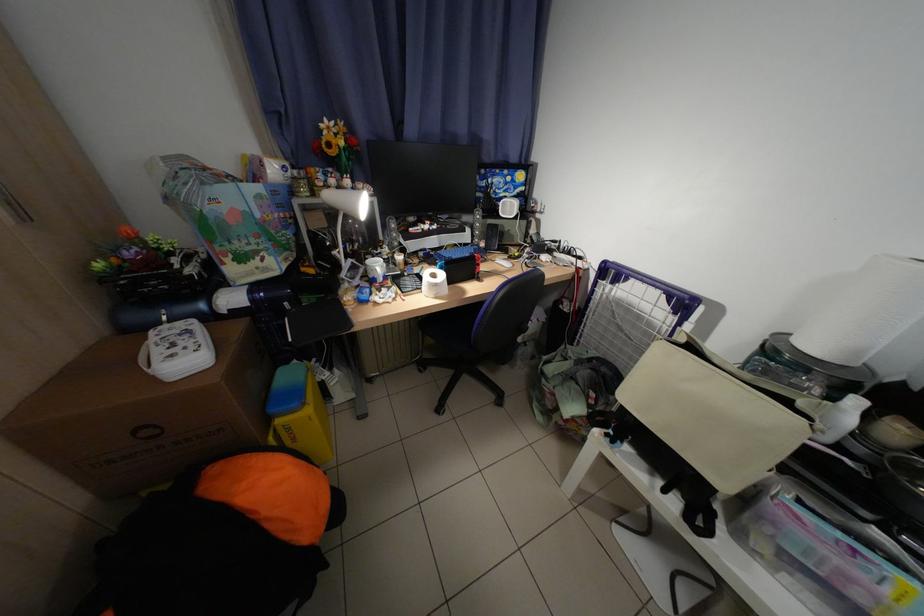
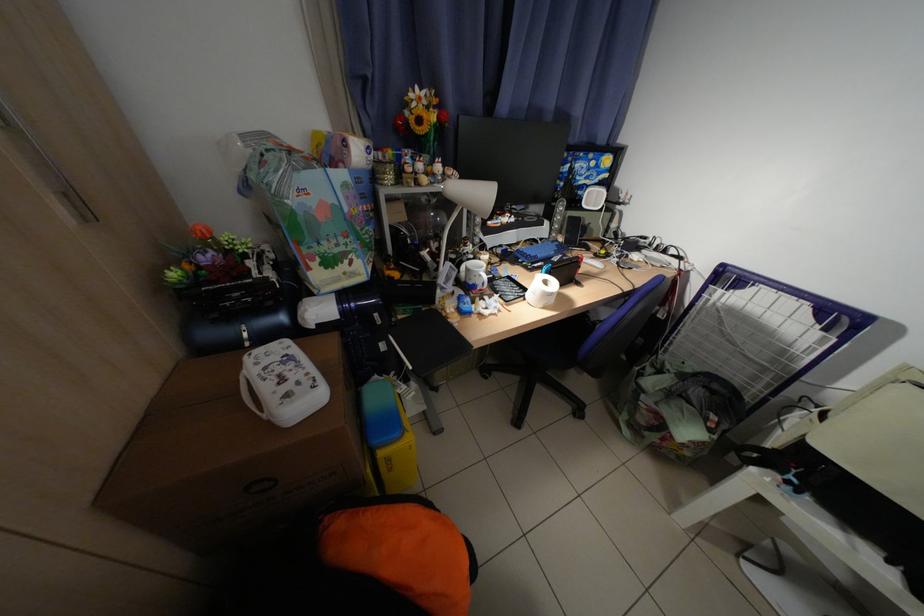
Question: How did the camera likely rotate?

Choices:
 (A) Left
 (B) Right
 (C) Up
 (D) Down

Answer: (D)